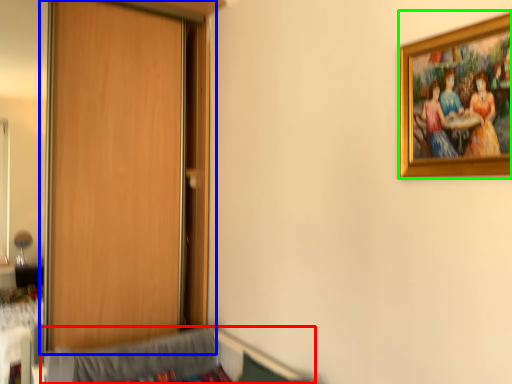
Question: Considering the real-world distances, which object is closest to hospital bed (highlighted by a red box)? door (highlighted by a blue box) or picture frame (highlighted by a green box).

Choices:
 (A) door
 (B) picture frame

Answer: (A)